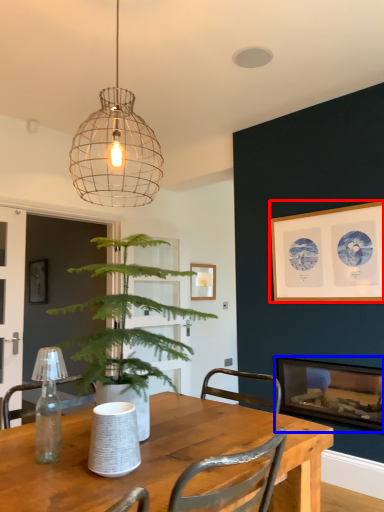
Question: Among these objects, which one is farthest to the camera, picture frame (highlighted by a red box) or fireplace (highlighted by a blue box)?

Choices:
 (A) picture frame
 (B) fireplace

Answer: (B)